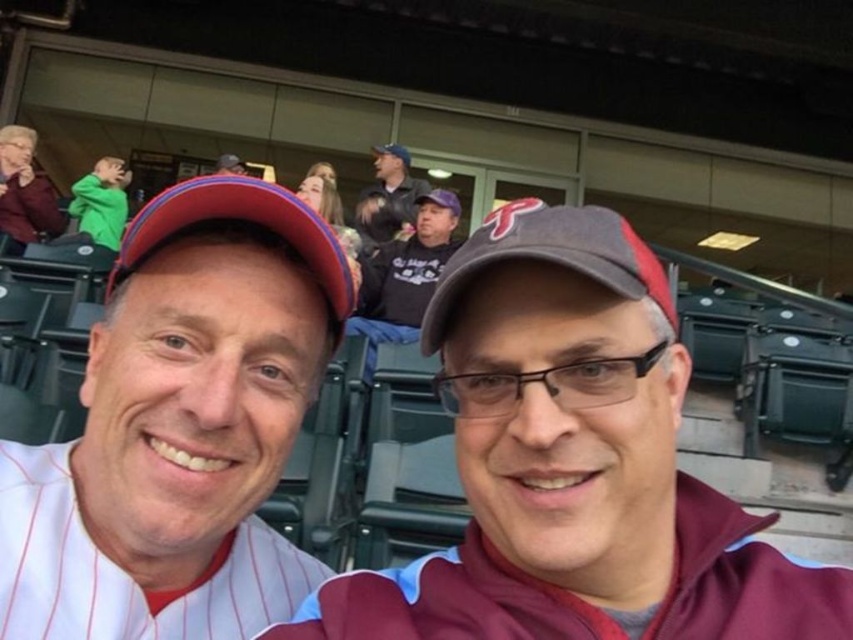
Is white pinstriped jersey at upper left to the right of dark gray hoodie at center from the viewer's perspective?

Incorrect, white pinstriped jersey at upper left is not on the right side of dark gray hoodie at center.

Which is more to the left, white pinstriped jersey at upper left or dark gray hoodie at center?

white pinstriped jersey at upper left

Measure the distance between white pinstriped jersey at upper left and camera.

white pinstriped jersey at upper left and camera are 18.88 inches apart from each other.

I want to click on white pinstriped jersey at upper left, so click(180, 428).

Is point (663, 429) more distant than point (369, 376)?

No, it is in front of (369, 376).

Can you confirm if maroon fabric jacket at center is positioned to the right of dark gray hoodie at center?

Correct, you'll find maroon fabric jacket at center to the right of dark gray hoodie at center.

Find the location of a particular element. The image size is (853, 640). maroon fabric jacket at center is located at coordinates (573, 465).

Identify the location of maroon fabric jacket at center. (573, 465).

Does maroon fabric jacket at center have a larger size compared to white pinstriped jersey at upper left?

No.

Between point (619, 600) and point (190, 333), which one is positioned behind?

The point (619, 600) is more distant.

Where is `maroon fabric jacket at center`? This screenshot has height=640, width=853. maroon fabric jacket at center is located at coordinates (573, 465).